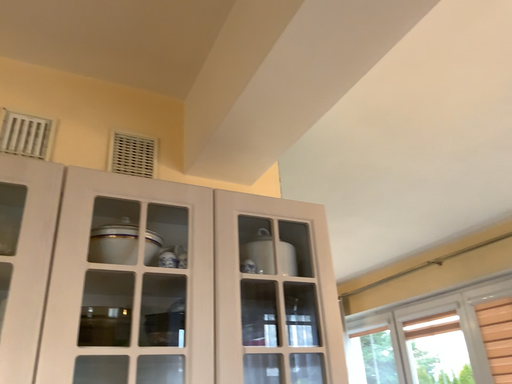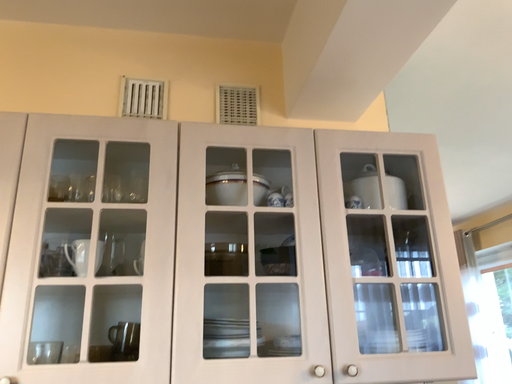
Question: How did the camera likely rotate when shooting the video?

Choices:
 (A) rotated right
 (B) rotated left

Answer: (B)